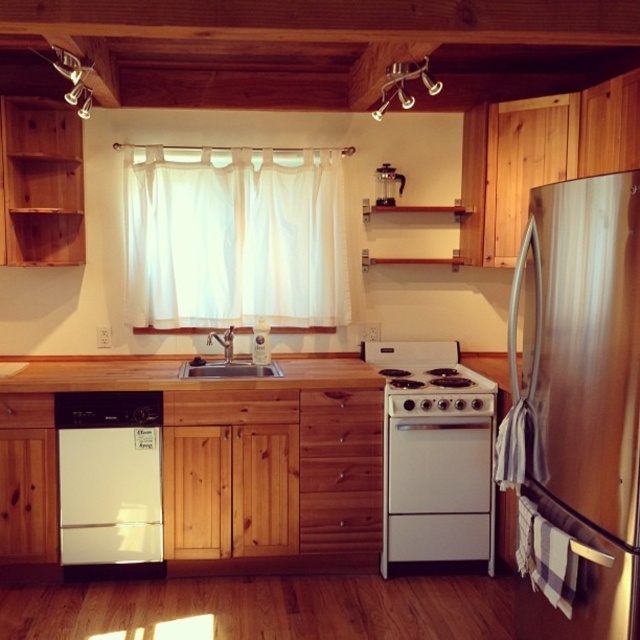
Question: Does white glossy dishwasher at lower left appear on the right side of wooden countertop at center?

Choices:
 (A) yes
 (B) no

Answer: (A)

Question: Which point is farther to the camera?

Choices:
 (A) brushed metal sink at center
 (B) white sheer curtain at center
 (C) stainless steel refrigerator at right
 (D) white glossy stove at center

Answer: (B)

Question: Which of these objects is positioned farthest from the white sheer curtain at center?

Choices:
 (A) stainless steel refrigerator at right
 (B) white glossy stove at center

Answer: (A)

Question: Is white glossy stove at center wider than brushed metal sink at center?

Choices:
 (A) no
 (B) yes

Answer: (B)

Question: Does white matte oven at center have a greater width compared to white glossy stove at center?

Choices:
 (A) no
 (B) yes

Answer: (A)

Question: Which object is positioned farthest from the stainless steel refrigerator at right?

Choices:
 (A) white glossy dishwasher at lower left
 (B) wooden countertop at center
 (C) white matte oven at center
 (D) brushed metal sink at center

Answer: (A)